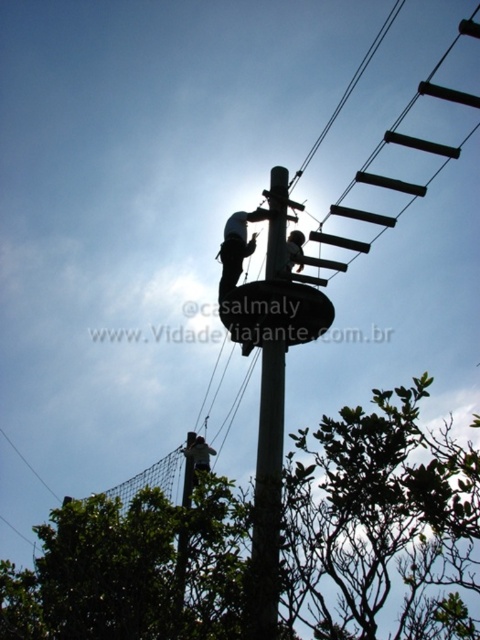
Which of these two, smooth wood telegraph pole at center or black plastic sign at center, stands taller?

smooth wood telegraph pole at center

Describe the element at coordinates (266, 497) in the screenshot. I see `smooth wood telegraph pole at center` at that location.

Where is `smooth wood telegraph pole at center`? The image size is (480, 640). smooth wood telegraph pole at center is located at coordinates (266, 497).

Which is more to the left, black plastic sign at center or green fabric harness at center?

Positioned to the left is green fabric harness at center.

Describe the element at coordinates (275, 312) in the screenshot. I see `black plastic sign at center` at that location.

Where is `black plastic sign at center`? The image size is (480, 640). black plastic sign at center is located at coordinates (275, 312).

Is green leafy tree at lower left shorter than green fabric harness at center?

In fact, green leafy tree at lower left may be taller than green fabric harness at center.

This screenshot has width=480, height=640. What are the coordinates of `green leafy tree at lower left` in the screenshot? It's located at point(381,524).